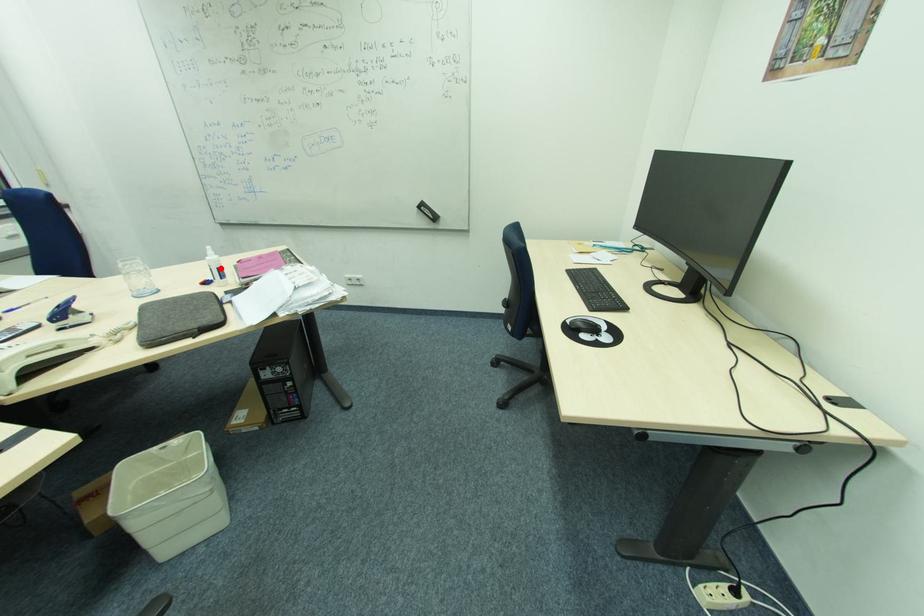
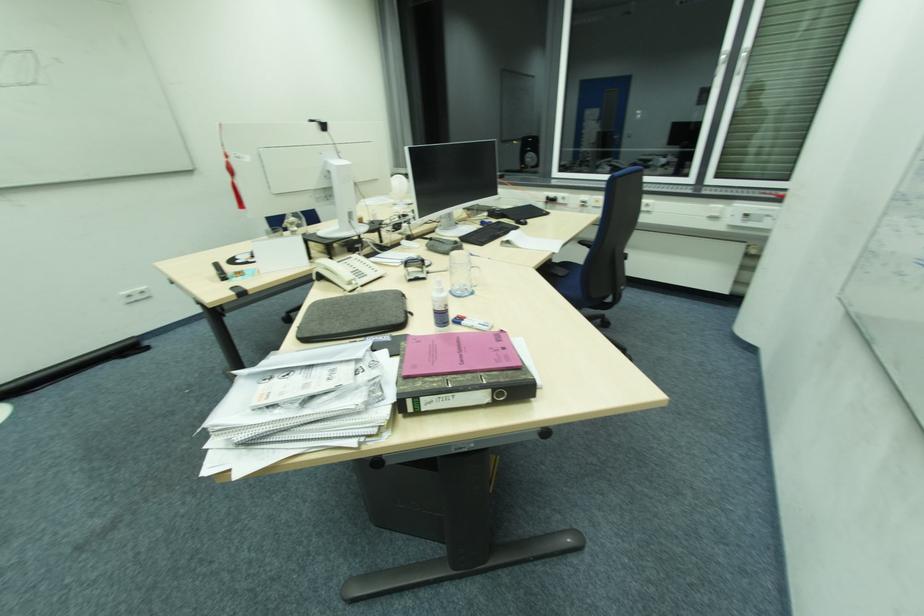
In the second image, find the point that corresponds to the highlighted location in the first image.

(436, 310)